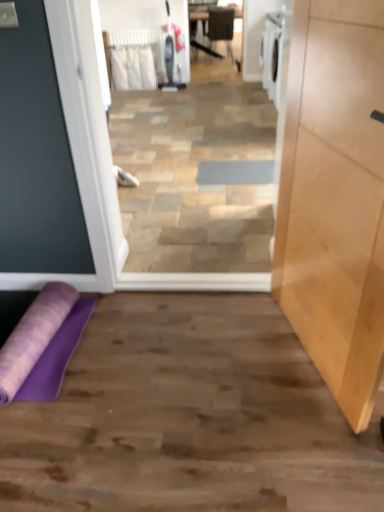
Question: Is purple fabric yoga mat at lower left taller or shorter than matte black chair at center?

Choices:
 (A) short
 (B) tall

Answer: (A)

Question: Do you think purple fabric yoga mat at lower left is within matte black chair at center, or outside of it?

Choices:
 (A) inside
 (B) outside

Answer: (B)

Question: Which object is the closest to the light wood cabinet at right?

Choices:
 (A) gray fabric doormat at center
 (B) matte black chair at center
 (C) purple fabric yoga mat at lower left

Answer: (C)

Question: Based on their relative distances, which object is nearer to the gray fabric doormat at center?

Choices:
 (A) purple fabric yoga mat at lower left
 (B) light wood cabinet at right
 (C) matte black chair at center

Answer: (B)